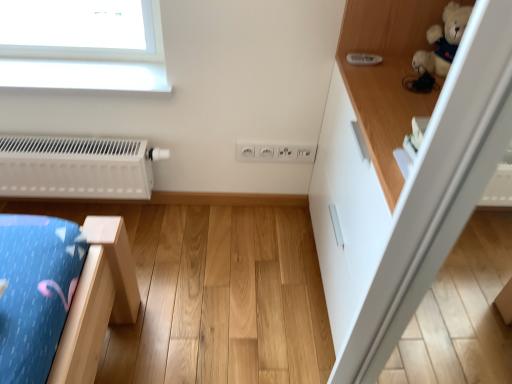
The height and width of the screenshot is (384, 512). What do you see at coordinates (409, 200) in the screenshot? I see `white glossy cabinet at upper right` at bounding box center [409, 200].

What is the approximate width of white glossy cabinet at upper right?

white glossy cabinet at upper right is 24.26 inches wide.

Find the location of a particular element. This screenshot has width=512, height=384. white plastic electric outlet at center is located at coordinates (275, 152).

From a real-world perspective, is white glossy cabinet at upper right above or below white matte radiator at left?

white glossy cabinet at upper right is situated higher than white matte radiator at left in the real world.

Which object is further away from the camera taking this photo, white glossy cabinet at upper right or white matte radiator at left?

Positioned behind is white matte radiator at left.

From the image's perspective, which is below, white glossy cabinet at upper right or white matte radiator at left?

white glossy cabinet at upper right appears lower in the image.

Can we say white glossy cabinet at upper right lies outside white plastic electric outlet at center?

That's correct, white glossy cabinet at upper right is outside of white plastic electric outlet at center.

Can you see white glossy cabinet at upper right touching white plastic electric outlet at center?

No, white glossy cabinet at upper right is not making contact with white plastic electric outlet at center.

Is white glossy cabinet at upper right positioned with its back to white plastic electric outlet at center?

That's not correct — white glossy cabinet at upper right is not looking away from white plastic electric outlet at center.

Which is less distant, (448, 203) or (258, 148)?

Point (448, 203) is closer to the camera than point (258, 148).

Is white matte radiator at left to the left of white glossy cabinet at upper right from the viewer's perspective?

Yes.

Which of these two, white matte radiator at left or white glossy cabinet at upper right, is thinner?

With smaller width is white matte radiator at left.

Is white matte radiator at left aimed at white glossy cabinet at upper right?

No, white matte radiator at left is not turned towards white glossy cabinet at upper right.

In the scene shown: Is white plastic electric outlet at center facing away from white glossy cabinet at upper right?

No, white glossy cabinet at upper right is not at the back of white plastic electric outlet at center.

Between white plastic electric outlet at center and white glossy cabinet at upper right, which one appears on the left side from the viewer's perspective?

white plastic electric outlet at center is more to the left.

Is white plastic electric outlet at center taller than white glossy cabinet at upper right?

In fact, white plastic electric outlet at center may be shorter than white glossy cabinet at upper right.

Is white glossy cabinet at upper right located within white plastic electric outlet at center?

No, white glossy cabinet at upper right is located outside of white plastic electric outlet at center.

Consider the image. Considering the relative sizes of white matte radiator at left and white plastic electric outlet at center in the image provided, is white matte radiator at left shorter than white plastic electric outlet at center?

Incorrect, the height of white matte radiator at left does not fall short of that of white plastic electric outlet at center.

In the scene shown: From a real-world perspective, is white matte radiator at left on white plastic electric outlet at center?

Actually, white matte radiator at left is physically below white plastic electric outlet at center in the real world.

Is white matte radiator at left wider or thinner than white plastic electric outlet at center?

In the image, white matte radiator at left appears to be wider than white plastic electric outlet at center.

Is white matte radiator at left not near white plastic electric outlet at center?

Actually, white matte radiator at left and white plastic electric outlet at center are a little close together.

Considering the sizes of objects white plastic electric outlet at center and white matte radiator at left in the image provided, who is smaller, white plastic electric outlet at center or white matte radiator at left?

Smaller between the two is white plastic electric outlet at center.

Considering the relative sizes of white plastic electric outlet at center and white matte radiator at left in the image provided, is white plastic electric outlet at center shorter than white matte radiator at left?

Yes, white plastic electric outlet at center is shorter than white matte radiator at left.

What's the angular difference between white plastic electric outlet at center and white matte radiator at left's facing directions?

The angle between the facing direction of white plastic electric outlet at center and the facing direction of white matte radiator at left is 0.353 degrees.

Is point (255, 145) in front of point (33, 187)?

That is False.

Locate an element on the screen. The width and height of the screenshot is (512, 384). radiator behind the white glossy cabinet at upper right is located at coordinates (77, 167).

Where is `dresser positioned vertically above the white plastic electric outlet at center (from a real-world perspective)`? dresser positioned vertically above the white plastic electric outlet at center (from a real-world perspective) is located at coordinates (409, 200).

Based on their spatial positions, is white plastic electric outlet at center or white glossy cabinet at upper right further from white matte radiator at left?

Based on the image, white glossy cabinet at upper right appears to be further to white matte radiator at left.

From the image, which object appears to be nearer to white plastic electric outlet at center, white glossy cabinet at upper right or white matte radiator at left?

white glossy cabinet at upper right lies closer to white plastic electric outlet at center than the other object.

In the scene shown: Which object lies further to the anchor point white glossy cabinet at upper right, white matte radiator at left or white plastic electric outlet at center?

white matte radiator at left is further to white glossy cabinet at upper right.

Looking at the image, which one is located closer to white glossy cabinet at upper right, white plastic electric outlet at center or white matte radiator at left?

Among the two, white plastic electric outlet at center is located nearer to white glossy cabinet at upper right.

From the image, which object appears to be farther from white matte radiator at left, white glossy cabinet at upper right or white plastic electric outlet at center?

white glossy cabinet at upper right is positioned further to the anchor white matte radiator at left.

Based on their spatial positions, is white matte radiator at left or white glossy cabinet at upper right further from white plastic electric outlet at center?

white matte radiator at left is positioned further to the anchor white plastic electric outlet at center.

Locate an element on the screen. This screenshot has width=512, height=384. electric outlet between white matte radiator at left and white glossy cabinet at upper right is located at coordinates (275, 152).